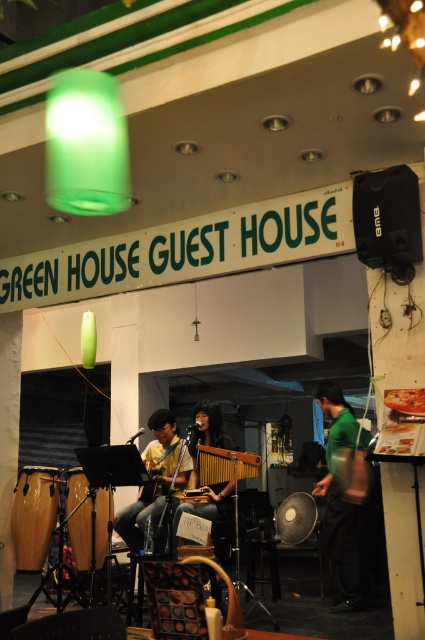
You are a photographer setting up for the live music event. You need to position your camera so that both the yellow fabric guitar at center and the wooden xylophone at center are in frame. Considering their heights, which object should you adjust the camera angle to focus on first to ensure both are visible?

The yellow fabric guitar at center is taller than the wooden xylophone at center. To ensure both are visible, adjust the camera angle to focus on the yellow fabric guitar at center first, then frame the wooden xylophone at center below it.